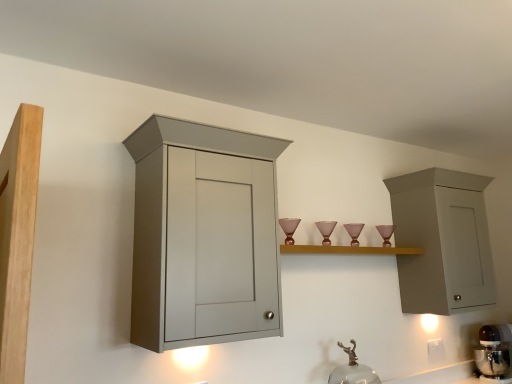
Question: Is white plastic electric outlet at lower right outside of transparent glass faucet at lower center?

Choices:
 (A) yes
 (B) no

Answer: (A)

Question: Considering the relative positions of white plastic electric outlet at lower right and transparent glass faucet at lower center in the image provided, is white plastic electric outlet at lower right behind transparent glass faucet at lower center?

Choices:
 (A) no
 (B) yes

Answer: (B)

Question: Is white plastic electric outlet at lower right taller than transparent glass faucet at lower center?

Choices:
 (A) yes
 (B) no

Answer: (B)

Question: Considering the relative sizes of white plastic electric outlet at lower right and transparent glass faucet at lower center in the image provided, is white plastic electric outlet at lower right smaller than transparent glass faucet at lower center?

Choices:
 (A) yes
 (B) no

Answer: (A)

Question: From a real-world perspective, is white plastic electric outlet at lower right over transparent glass faucet at lower center?

Choices:
 (A) yes
 (B) no

Answer: (B)

Question: From the image's perspective, does white plastic electric outlet at lower right appear lower than transparent glass faucet at lower center?

Choices:
 (A) no
 (B) yes

Answer: (B)

Question: Can you confirm if metallic silver mixer at lower right is thinner than matte gray cabinet at left, positioned as the 1th cabinetry in front-to-back order?

Choices:
 (A) no
 (B) yes

Answer: (B)

Question: Can you confirm if metallic silver mixer at lower right is positioned to the left of matte gray cabinet at left, acting as the second cabinetry starting from the back?

Choices:
 (A) yes
 (B) no

Answer: (B)

Question: Can you confirm if metallic silver mixer at lower right is positioned to the right of matte gray cabinet at left, acting as the second cabinetry starting from the back?

Choices:
 (A) no
 (B) yes

Answer: (B)

Question: Would you consider metallic silver mixer at lower right to be distant from matte gray cabinet at left, which appears as the first cabinetry when viewed from the left?

Choices:
 (A) yes
 (B) no

Answer: (A)

Question: Is metallic silver mixer at lower right positioned before matte gray cabinet at left, which appears as the first cabinetry when viewed from the left?

Choices:
 (A) no
 (B) yes

Answer: (A)

Question: Is metallic silver mixer at lower right positioned behind matte gray cabinet at left, the second cabinetry from the right?

Choices:
 (A) yes
 (B) no

Answer: (A)

Question: Is transparent glass faucet at lower center at the right side of matte wood cupboard at left?

Choices:
 (A) no
 (B) yes

Answer: (B)